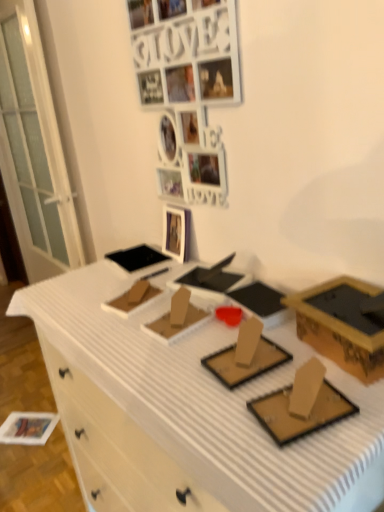
You are a GUI agent. You are given a task and a screenshot of the screen. Output one action in this format:
    pyautogui.click(x=<x>, y=<y>)
    Task: Click on the free space above gold cardboard box at right (from a real-world perspective)
    Image resolution: width=384 pixels, height=512 pixels.
    Given the screenshot: What is the action you would take?
    pyautogui.click(x=351, y=312)